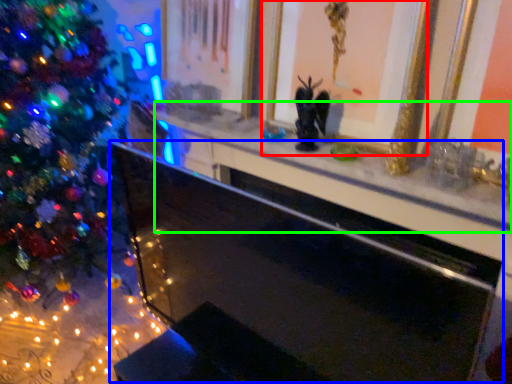
Question: Considering the real-world distances, which object is closest to picture frame (highlighted by a red box)? fireplace (highlighted by a blue box) or mantle (highlighted by a green box).

Choices:
 (A) fireplace
 (B) mantle

Answer: (B)